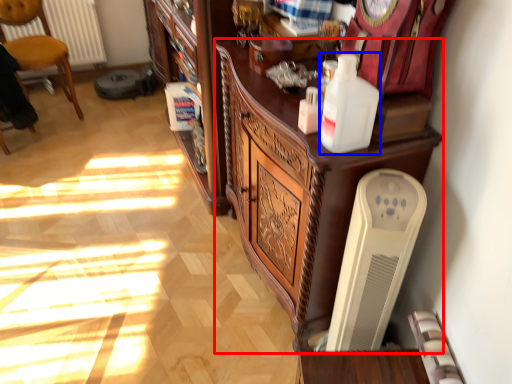
Question: Which of the following is the closest to the observer, cabinetry (highlighted by a red box) or bottle (highlighted by a blue box)?

Choices:
 (A) cabinetry
 (B) bottle

Answer: (B)